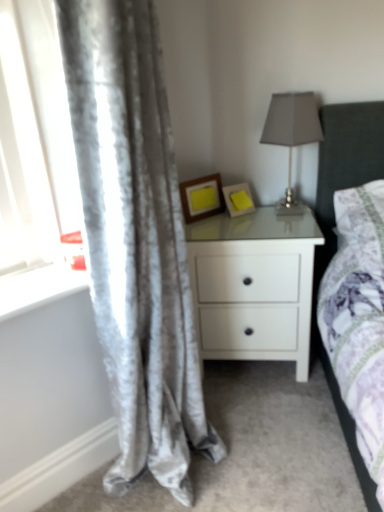
Where is `vacant space in between yellow matte picture frame at center, which is counted as the first picture frame, starting from the left, and yellow matte picture frame at upper center, which ranks as the first picture frame in right-to-left order`? vacant space in between yellow matte picture frame at center, which is counted as the first picture frame, starting from the left, and yellow matte picture frame at upper center, which ranks as the first picture frame in right-to-left order is located at coordinates (215, 218).